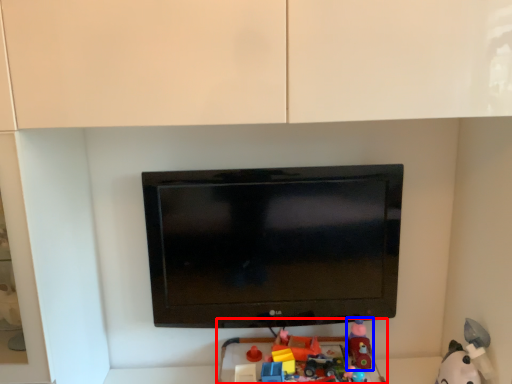
Question: Which of the following is the closest to the observer, toy (highlighted by a red box) or toy (highlighted by a blue box)?

Choices:
 (A) toy
 (B) toy

Answer: (A)